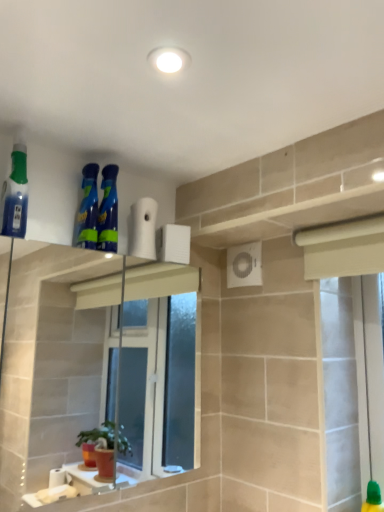
Identify the location of blue glossy spray bottles at upper center, the second cleaning product positioned from the left. This screenshot has width=384, height=512. (87, 210).

Considering the relative positions of translucent blue spray bottle at left, which appears as the third cleaning product when viewed from the right, and blue glossy spray bottles at upper center, the second cleaning product positioned from the left, in the image provided, is translucent blue spray bottle at left, which appears as the third cleaning product when viewed from the right, to the left or to the right of blue glossy spray bottles at upper center, the second cleaning product positioned from the left,?

translucent blue spray bottle at left, which appears as the third cleaning product when viewed from the right, is to the left of blue glossy spray bottles at upper center, the second cleaning product positioned from the left.

Based on the photo, measure the distance between translucent blue spray bottle at left, which appears as the third cleaning product when viewed from the right, and blue glossy spray bottles at upper center, the second cleaning product positioned from the left.

The distance of translucent blue spray bottle at left, which appears as the third cleaning product when viewed from the right, from blue glossy spray bottles at upper center, the second cleaning product positioned from the left, is 7.73 inches.

Considering the sizes of translucent blue spray bottle at left, which appears as the third cleaning product when viewed from the right, and blue glossy spray bottles at upper center, the second cleaning product viewed from the right, in the image, is translucent blue spray bottle at left, which appears as the third cleaning product when viewed from the right, bigger or smaller than blue glossy spray bottles at upper center, the second cleaning product viewed from the right,?

In the image, translucent blue spray bottle at left, which appears as the third cleaning product when viewed from the right, appears to be larger than blue glossy spray bottles at upper center, the second cleaning product viewed from the right.

Locate an element on the screen. cleaning product on the left of blue glossy spray bottles at upper center, the second cleaning product viewed from the right is located at coordinates (15, 196).

Which is behind, point (83, 199) or point (146, 247)?

Positioned behind is point (146, 247).

From a real-world perspective, which is physically above, blue glossy spray bottles at upper center, the second cleaning product positioned from the left, or white matte toilet paper at upper center?

blue glossy spray bottles at upper center, the second cleaning product positioned from the left.

Consider the image. Visually, is blue glossy spray bottles at upper center, the second cleaning product positioned from the left, positioned to the left or to the right of white matte toilet paper at upper center?

Clearly, blue glossy spray bottles at upper center, the second cleaning product positioned from the left, is on the left of white matte toilet paper at upper center in the image.

Considering the sizes of objects blue glossy spray bottles at upper center, the second cleaning product positioned from the left, and white matte toilet paper at upper center in the image provided, who is wider, blue glossy spray bottles at upper center, the second cleaning product positioned from the left, or white matte toilet paper at upper center?

Wider between the two is blue glossy spray bottles at upper center, the second cleaning product positioned from the left.

Could you tell me if blue glossy spray bottles at upper center, acting as the 3th cleaning product starting from the left, is turned towards blue glossy spray bottles at upper center, the second cleaning product positioned from the left?

No, blue glossy spray bottles at upper center, acting as the 3th cleaning product starting from the left, is not facing towards blue glossy spray bottles at upper center, the second cleaning product positioned from the left.

Would you say blue glossy spray bottles at upper center, which appears as the 1th cleaning product when viewed from the right, is outside blue glossy spray bottles at upper center, the second cleaning product positioned from the left?

That's correct, blue glossy spray bottles at upper center, which appears as the 1th cleaning product when viewed from the right, is outside of blue glossy spray bottles at upper center, the second cleaning product positioned from the left.

Looking at this image, considering the relative positions of blue glossy spray bottles at upper center, which appears as the 1th cleaning product when viewed from the right, and blue glossy spray bottles at upper center, the second cleaning product positioned from the left, in the image provided, is blue glossy spray bottles at upper center, which appears as the 1th cleaning product when viewed from the right, to the right of blue glossy spray bottles at upper center, the second cleaning product positioned from the left, from the viewer's perspective?

Indeed, blue glossy spray bottles at upper center, which appears as the 1th cleaning product when viewed from the right, is positioned on the right side of blue glossy spray bottles at upper center, the second cleaning product positioned from the left.

Which of these two, blue glossy spray bottles at upper center, acting as the 3th cleaning product starting from the left, or blue glossy spray bottles at upper center, the second cleaning product viewed from the right, is thinner?

With smaller width is blue glossy spray bottles at upper center, acting as the 3th cleaning product starting from the left.

How different are the orientations of white matte toilet paper at upper center and translucent blue spray bottle at left, the 1th cleaning product in the left-to-right sequence, in degrees?

They differ by 4.94 degrees in their facing directions.

Does white matte toilet paper at upper center have a lesser width compared to translucent blue spray bottle at left, the 1th cleaning product in the left-to-right sequence?

Correct, the width of white matte toilet paper at upper center is less than that of translucent blue spray bottle at left, the 1th cleaning product in the left-to-right sequence.

Is white matte toilet paper at upper center not inside translucent blue spray bottle at left, the 1th cleaning product in the left-to-right sequence?

Yes.

Does white matte toilet paper at upper center turn towards translucent blue spray bottle at left, the 1th cleaning product in the left-to-right sequence?

No, white matte toilet paper at upper center does not turn towards translucent blue spray bottle at left, the 1th cleaning product in the left-to-right sequence.

From the white matte toilet paper at upper center, count the 1st cleaning product to the left and point to it. Please provide its 2D coordinates.

[(108, 211)]

Does blue glossy spray bottles at upper center, which appears as the 1th cleaning product when viewed from the right, lie behind white matte toilet paper at upper center?

No, it is in front of white matte toilet paper at upper center.

Does blue glossy spray bottles at upper center, acting as the 3th cleaning product starting from the left, have a smaller size compared to white matte toilet paper at upper center?

Correct, blue glossy spray bottles at upper center, acting as the 3th cleaning product starting from the left, occupies less space than white matte toilet paper at upper center.

Is point (82, 234) positioned after point (23, 183)?

That is True.

Choose the correct answer: Is blue glossy spray bottles at upper center, the second cleaning product positioned from the left, inside translucent blue spray bottle at left, which appears as the third cleaning product when viewed from the right, or outside it?

blue glossy spray bottles at upper center, the second cleaning product positioned from the left, is not enclosed by translucent blue spray bottle at left, which appears as the third cleaning product when viewed from the right.

Which object is positioned more to the left, blue glossy spray bottles at upper center, the second cleaning product positioned from the left, or translucent blue spray bottle at left, which appears as the third cleaning product when viewed from the right?

translucent blue spray bottle at left, which appears as the third cleaning product when viewed from the right, is more to the left.

Which object is further away from the camera, white matte toilet paper at upper center or blue glossy spray bottles at upper center, acting as the 3th cleaning product starting from the left?

white matte toilet paper at upper center.

From the image's perspective, between white matte toilet paper at upper center and blue glossy spray bottles at upper center, which appears as the 1th cleaning product when viewed from the right, who is located below?

white matte toilet paper at upper center appears lower in the image.

From a real-world perspective, which object stands above the other?

From a 3D spatial view, blue glossy spray bottles at upper center, acting as the 3th cleaning product starting from the left, is above.

Can you tell me how much white matte toilet paper at upper center and blue glossy spray bottles at upper center, acting as the 3th cleaning product starting from the left, differ in facing direction?

The facing directions of white matte toilet paper at upper center and blue glossy spray bottles at upper center, acting as the 3th cleaning product starting from the left, are 0.000309 degrees apart.

Locate an element on the screen. The image size is (384, 512). the 1st cleaning product below when counting from the translucent blue spray bottle at left, which appears as the third cleaning product when viewed from the right (from the image's perspective) is located at coordinates (87, 210).

Identify the location of the 2nd cleaning product above the white matte toilet paper at upper center (from the image's perspective). The width and height of the screenshot is (384, 512). (87, 210).

When comparing their distances from blue glossy spray bottles at upper center, which appears as the 1th cleaning product when viewed from the right, does blue glossy spray bottles at upper center, the second cleaning product viewed from the right, or translucent blue spray bottle at left, which appears as the third cleaning product when viewed from the right, seem closer?

blue glossy spray bottles at upper center, the second cleaning product viewed from the right, is closer to blue glossy spray bottles at upper center, which appears as the 1th cleaning product when viewed from the right.

Looking at the image, which one is located closer to blue glossy spray bottles at upper center, which appears as the 1th cleaning product when viewed from the right, white matte toilet paper at upper center or translucent blue spray bottle at left, the 1th cleaning product in the left-to-right sequence?

white matte toilet paper at upper center is positioned closer to the anchor blue glossy spray bottles at upper center, which appears as the 1th cleaning product when viewed from the right.

Which object lies further to the anchor point translucent blue spray bottle at left, which appears as the third cleaning product when viewed from the right, white matte toilet paper at upper center or blue glossy spray bottles at upper center, the second cleaning product viewed from the right?

The object further to translucent blue spray bottle at left, which appears as the third cleaning product when viewed from the right, is white matte toilet paper at upper center.

Estimate the real-world distances between objects in this image. Which object is closer to white matte toilet paper at upper center, translucent blue spray bottle at left, the 1th cleaning product in the left-to-right sequence, or blue glossy spray bottles at upper center, acting as the 3th cleaning product starting from the left?

The object closer to white matte toilet paper at upper center is blue glossy spray bottles at upper center, acting as the 3th cleaning product starting from the left.

Considering their positions, is white matte toilet paper at upper center positioned closer to blue glossy spray bottles at upper center, the second cleaning product viewed from the right, than translucent blue spray bottle at left, the 1th cleaning product in the left-to-right sequence?

Based on the image, white matte toilet paper at upper center appears to be nearer to blue glossy spray bottles at upper center, the second cleaning product viewed from the right.

Based on their spatial positions, is blue glossy spray bottles at upper center, the second cleaning product viewed from the right, or translucent blue spray bottle at left, which appears as the third cleaning product when viewed from the right, further from white matte toilet paper at upper center?

Based on the image, translucent blue spray bottle at left, which appears as the third cleaning product when viewed from the right, appears to be further to white matte toilet paper at upper center.

Estimate the real-world distances between objects in this image. Which object is closer to blue glossy spray bottles at upper center, which appears as the 1th cleaning product when viewed from the right, translucent blue spray bottle at left, which appears as the third cleaning product when viewed from the right, or blue glossy spray bottles at upper center, the second cleaning product viewed from the right?

blue glossy spray bottles at upper center, the second cleaning product viewed from the right, is positioned closer to the anchor blue glossy spray bottles at upper center, which appears as the 1th cleaning product when viewed from the right.

Based on their spatial positions, is blue glossy spray bottles at upper center, the second cleaning product viewed from the right, or blue glossy spray bottles at upper center, acting as the 3th cleaning product starting from the left, further from translucent blue spray bottle at left, which appears as the third cleaning product when viewed from the right?

Based on the image, blue glossy spray bottles at upper center, acting as the 3th cleaning product starting from the left, appears to be further to translucent blue spray bottle at left, which appears as the third cleaning product when viewed from the right.

Find the location of a particular element. cleaning product between translucent blue spray bottle at left, which appears as the third cleaning product when viewed from the right, and blue glossy spray bottles at upper center, which appears as the 1th cleaning product when viewed from the right is located at coordinates (87, 210).

At what (x,y) coordinates should I click in order to perform the action: click on cleaning product located between blue glossy spray bottles at upper center, the second cleaning product positioned from the left, and white matte toilet paper at upper center in the left-right direction. Please return your answer as a coordinate pair (x, y). The width and height of the screenshot is (384, 512). Looking at the image, I should click on (108, 211).